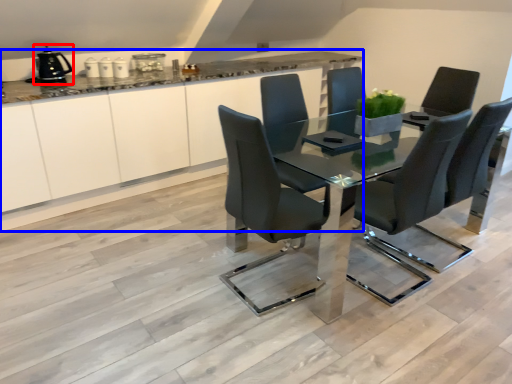
Question: Which object is closer to the camera taking this photo, appliance (highlighted by a red box) or cabinetry (highlighted by a blue box)?

Choices:
 (A) appliance
 (B) cabinetry

Answer: (B)